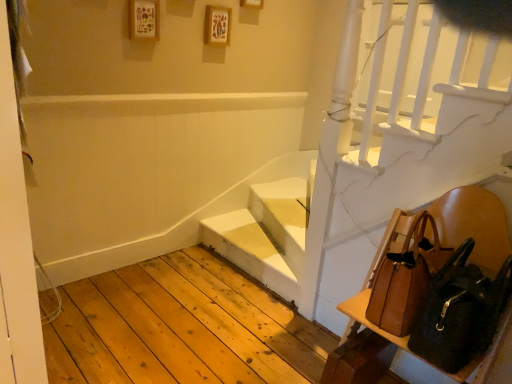
Question: Is brown leather chair at lower right with brown leather shoulder bag at right, which ranks as the 1th shoulder bag in back-to-front order?

Choices:
 (A) yes
 (B) no

Answer: (A)

Question: Can you confirm if brown leather chair at lower right is shorter than brown leather shoulder bag at right, which ranks as the 1th shoulder bag in back-to-front order?

Choices:
 (A) no
 (B) yes

Answer: (A)

Question: From a real-world perspective, is brown leather chair at lower right physically above brown leather shoulder bag at right, placed as the second shoulder bag when sorted from front to back?

Choices:
 (A) yes
 (B) no

Answer: (B)

Question: Is brown leather chair at lower right far away from brown leather shoulder bag at right, which ranks as the 1th shoulder bag in back-to-front order?

Choices:
 (A) yes
 (B) no

Answer: (B)

Question: From a real-world perspective, is brown leather chair at lower right under brown leather shoulder bag at right, placed as the second shoulder bag when sorted from front to back?

Choices:
 (A) no
 (B) yes

Answer: (B)

Question: Is brown leather shoulder bag at right, placed as the second shoulder bag when sorted from front to back, taller or shorter than brown leather chair at lower right?

Choices:
 (A) short
 (B) tall

Answer: (A)

Question: From the image's perspective, is brown leather shoulder bag at right, which ranks as the 1th shoulder bag in back-to-front order, above or below brown leather chair at lower right?

Choices:
 (A) above
 (B) below

Answer: (A)

Question: Considering their positions, is brown leather shoulder bag at right, which ranks as the 1th shoulder bag in back-to-front order, located in front of or behind brown leather chair at lower right?

Choices:
 (A) front
 (B) behind

Answer: (B)

Question: Is point (425, 248) closer or farther from the camera than point (429, 223)?

Choices:
 (A) closer
 (B) farther

Answer: (A)

Question: Would you say brown leather chair at lower right is to the left or to the right of white matte stairs at center in the picture?

Choices:
 (A) right
 (B) left

Answer: (A)

Question: Is brown leather chair at lower right wider or thinner than white matte stairs at center?

Choices:
 (A) wide
 (B) thin

Answer: (A)

Question: From a real-world perspective, relative to white matte stairs at center, is brown leather chair at lower right vertically above or below?

Choices:
 (A) above
 (B) below

Answer: (A)

Question: Considering the positions of brown leather chair at lower right and white matte stairs at center in the image, is brown leather chair at lower right taller or shorter than white matte stairs at center?

Choices:
 (A) tall
 (B) short

Answer: (A)

Question: Considering the positions of brown leather shoulder bag at lower right, acting as the 2th shoulder bag starting from the back, and brown leather chair at lower right in the image, is brown leather shoulder bag at lower right, acting as the 2th shoulder bag starting from the back, bigger or smaller than brown leather chair at lower right?

Choices:
 (A) small
 (B) big

Answer: (A)

Question: In terms of height, does brown leather shoulder bag at lower right, acting as the 2th shoulder bag starting from the back, look taller or shorter compared to brown leather chair at lower right?

Choices:
 (A) short
 (B) tall

Answer: (A)